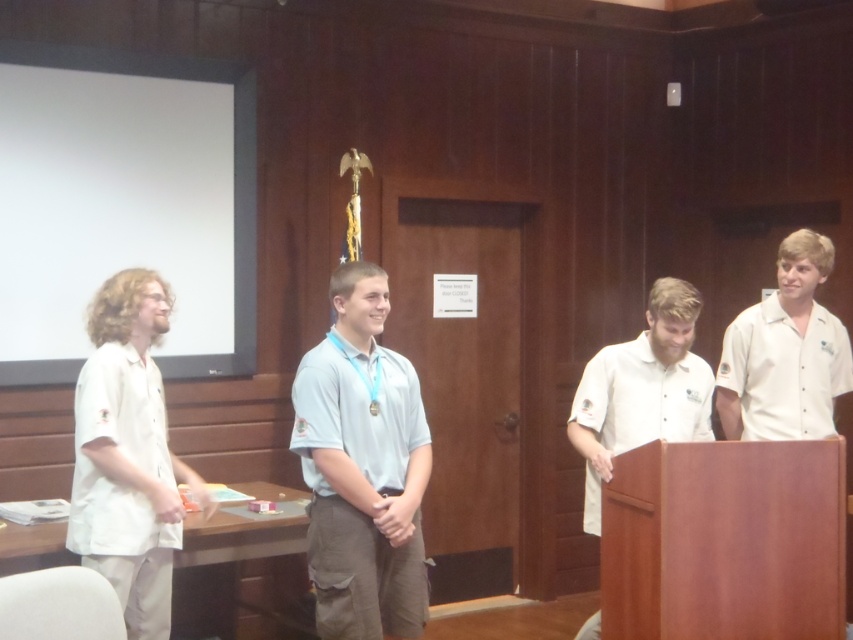
You are at a formal event and need to locate two specific attendees. The light blue fabric shirt at center and the white cotton shirt at left are both present. Which attendee is positioned more to the left side of the scene?

The white cotton shirt at left is positioned more to the left side of the scene.